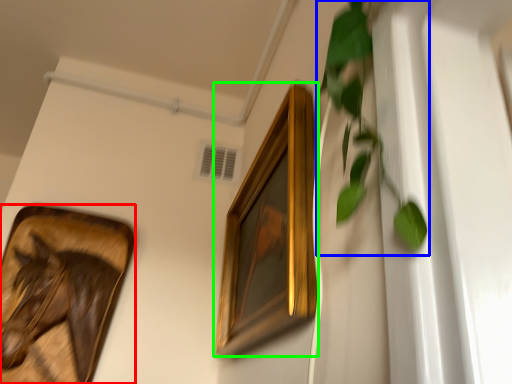
Question: Based on their relative distances, which object is farther from picture frame (highlighted by a red box)? Choose from vegetation (highlighted by a blue box) and picture frame (highlighted by a green box).

Choices:
 (A) vegetation
 (B) picture frame

Answer: (A)